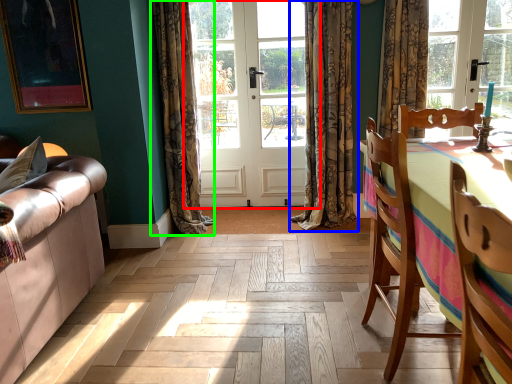
Question: Based on their relative distances, which object is farther from door (highlighted by a red box)? Choose from curtain (highlighted by a blue box) and curtain (highlighted by a green box).

Choices:
 (A) curtain
 (B) curtain

Answer: (B)